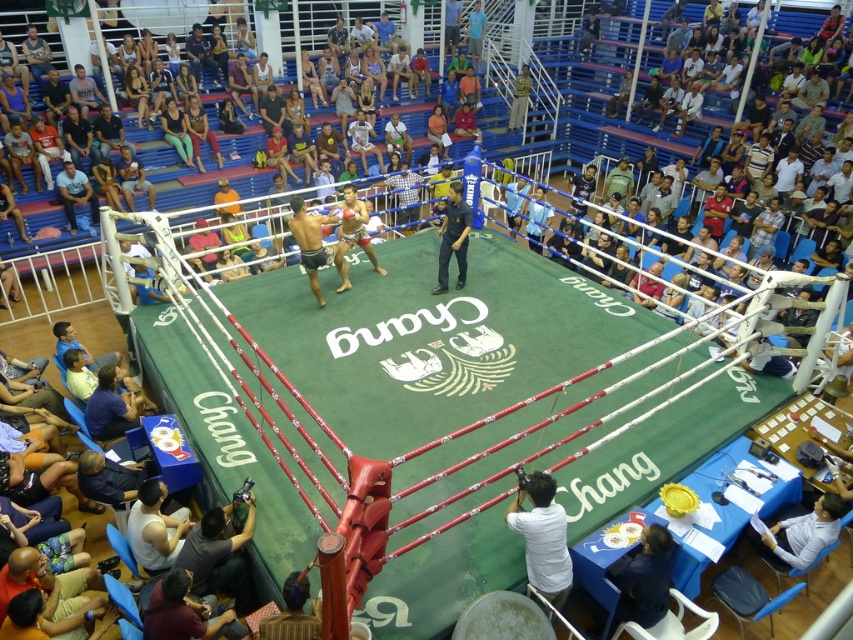
Does dark gray fabric at lower left appear over dark blue jeans at center?

No, dark gray fabric at lower left is not above dark blue jeans at center.

Who is more distant from viewer, (209, 588) or (442, 266)?

The point (442, 266) is more distant.

Between point (196, 540) and point (463, 212), which one is positioned behind?

Positioned behind is point (463, 212).

Where is `dark gray fabric at lower left`? dark gray fabric at lower left is located at coordinates (219, 556).

Is dark gray fabric at lower left to the right of matte blue shirt at left from the viewer's perspective?

Indeed, dark gray fabric at lower left is positioned on the right side of matte blue shirt at left.

Who is more forward, (x=239, y=534) or (x=67, y=196)?

Point (x=239, y=534) is in front.

Find the location of `dark gray fabric at lower left`. dark gray fabric at lower left is located at coordinates (219, 556).

Who is taller, dark blue jeans at center or matte blue shirt at left?

dark blue jeans at center is taller.

Is dark blue jeans at center bigger than matte blue shirt at left?

Indeed, dark blue jeans at center has a larger size compared to matte blue shirt at left.

This screenshot has height=640, width=853. Describe the element at coordinates (453, 237) in the screenshot. I see `dark blue jeans at center` at that location.

Locate an element on the screen. dark blue jeans at center is located at coordinates (453, 237).